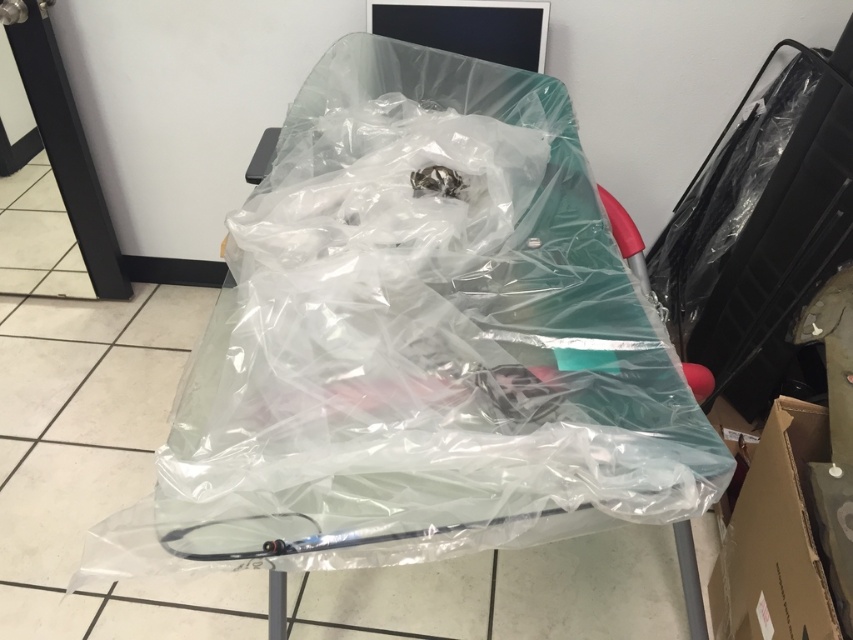
You are a nurse preparing to store medical supplies. You have a transparent plastic bag at center and a brown cardboard box at lower right. Which container can hold more height for items like a tall thermometer?

The transparent plastic bag at center is much taller than the brown cardboard box at lower right, so it can accommodate taller items like a thermometer better.

You are a nurse in a hospital. You need to place a medical chart on the table so that it is closer to the stethoscope than to the computer monitor. The stethoscope is at point (x=355, y=365) and the computer monitor is at point (x=817, y=442). Where should you place the chart?

Place the medical chart closer to point (x=355, y=365) where the stethoscope is located. Since point (x=355, y=365) is in front of point (x=817, y=442), placing it near the stethoscope ensures it is closer to the stethoscope than the computer monitor.